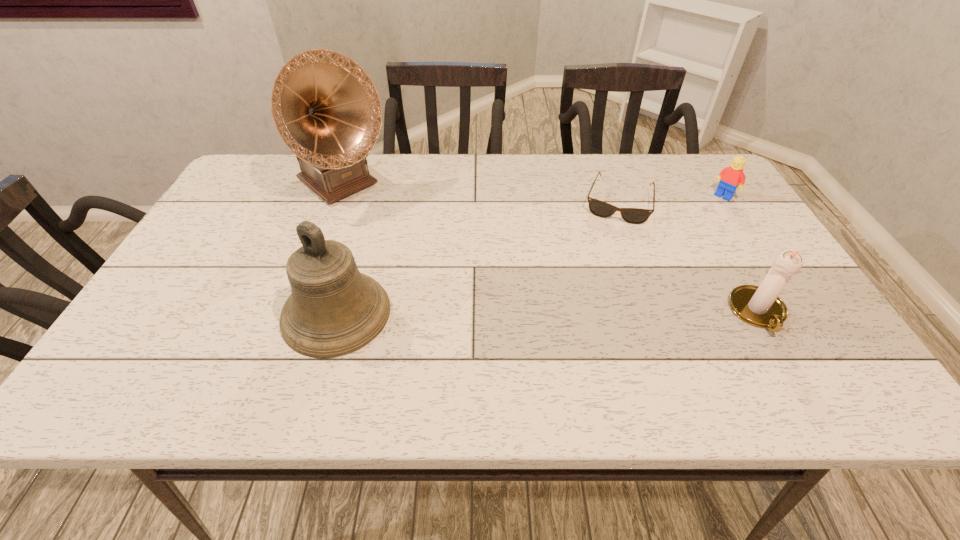
Locate an element on the screen. phonograph record that is at the far edge is located at coordinates (325, 107).

The height and width of the screenshot is (540, 960). In order to click on bell that is positioned at the near edge in this screenshot , I will do (x=334, y=310).

The width and height of the screenshot is (960, 540). I want to click on candle holder that is at the near edge, so click(x=760, y=306).

This screenshot has width=960, height=540. I want to click on candle holder that is at the right edge, so click(x=760, y=306).

Find the location of a particular element. This screenshot has width=960, height=540. Lego that is positioned at the right edge is located at coordinates (730, 177).

This screenshot has height=540, width=960. Identify the location of object present at the far right corner. (730, 177).

The width and height of the screenshot is (960, 540). I want to click on object located in the near right corner section of the desktop, so click(x=760, y=306).

The width and height of the screenshot is (960, 540). In the image, there is a desktop. Identify the location of vacant space at the far edge. (615, 156).

Locate an element on the screen. vacant space at the near edge of the desktop is located at coordinates (504, 338).

The width and height of the screenshot is (960, 540). I want to click on free space at the left edge, so click(177, 303).